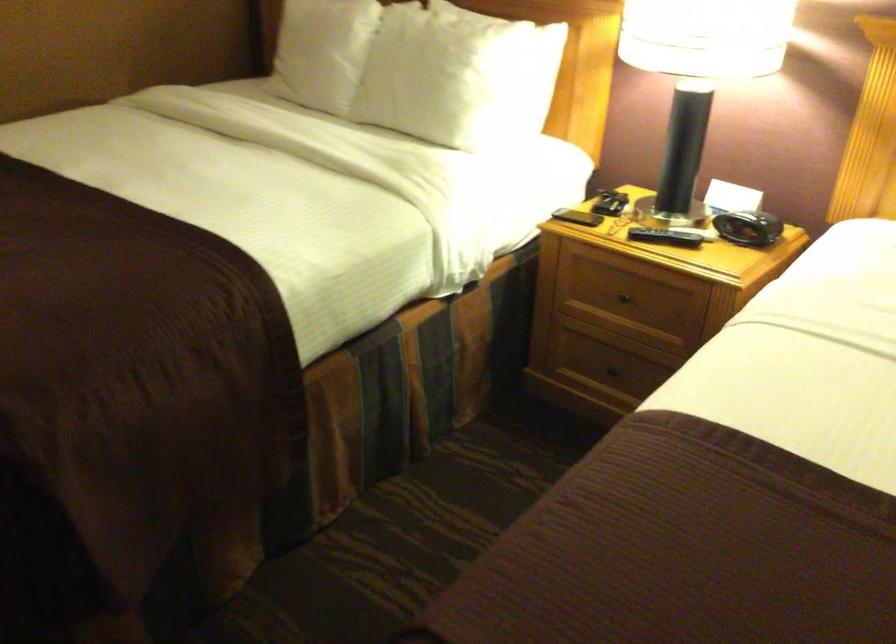
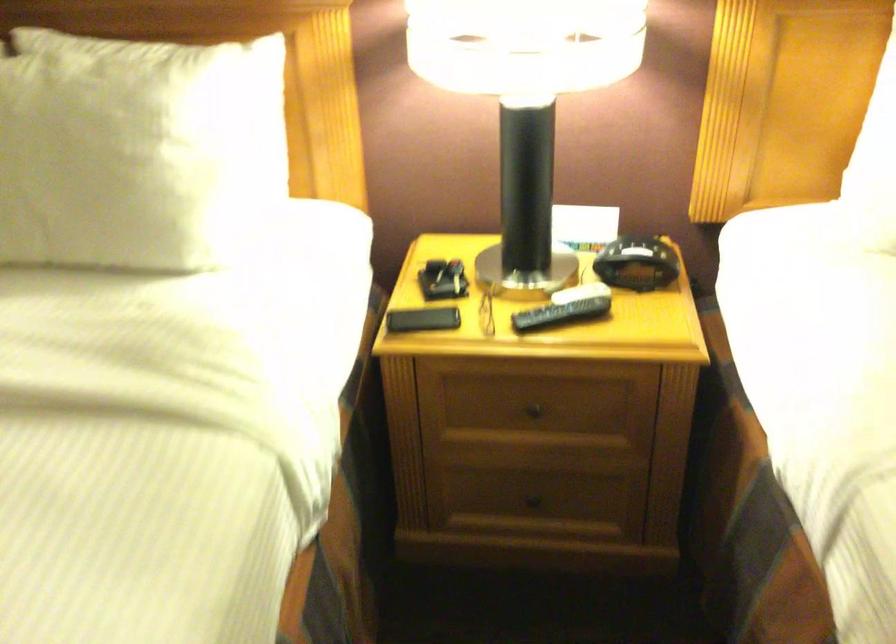
Locate, in the second image, the point that corresponds to point 449,69 in the first image.

(134, 149)